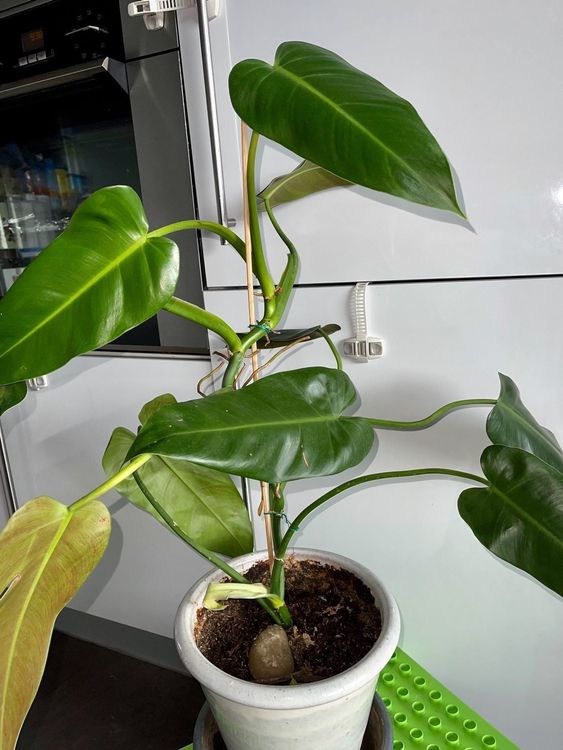
At what (x,y) coordinates should I click in order to perform the action: click on plant. Please return your answer as a coordinate pair (x, y). Looking at the image, I should click on (280, 308).